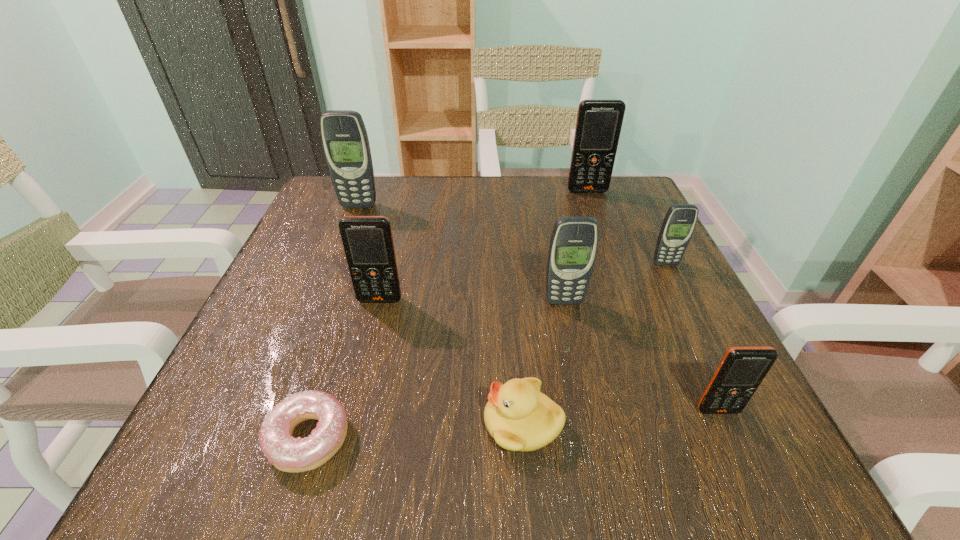
You are a GUI agent. You are given a task and a screenshot of the screen. Output one action in this format:
    pyautogui.click(x=<x>, y=<y>)
    Task: Click on the object that stands as the fourth closest to the second biggest orange cellular telephone
    
    Given the screenshot: What is the action you would take?
    pyautogui.click(x=344, y=137)

Image resolution: width=960 pixels, height=540 pixels. What are the coordinates of `cellular telephone that can be found as the closest to the farthest gray cellular telephone` in the screenshot? It's located at (368, 243).

Select which cellular telephone appears as the second closest to the farthest object. Please provide its 2D coordinates. Your answer should be formatted as a tuple, i.e. [(x, y)], where the tuple contains the x and y coordinates of a point satisfying the conditions above.

[(573, 246)]

Locate which orange cellular telephone is the closest to the nearest orange cellular telephone. Please provide its 2D coordinates. Your answer should be formatted as a tuple, i.e. [(x, y)], where the tuple contains the x and y coordinates of a point satisfying the conditions above.

[(368, 243)]

Select which orange cellular telephone is the second closest to the leftmost gray cellular telephone. Please provide its 2D coordinates. Your answer should be formatted as a tuple, i.e. [(x, y)], where the tuple contains the x and y coordinates of a point satisfying the conditions above.

[(599, 122)]

Identify which gray cellular telephone is the second nearest to the nearest gray cellular telephone. Please provide its 2D coordinates. Your answer should be formatted as a tuple, i.e. [(x, y)], where the tuple contains the x and y coordinates of a point satisfying the conditions above.

[(344, 137)]

Where is `gray cellular telephone that stands as the second closest to the leftmost gray cellular telephone`? This screenshot has width=960, height=540. gray cellular telephone that stands as the second closest to the leftmost gray cellular telephone is located at coordinates (677, 228).

Identify the location of free space that satisfies the following two spatial constraints: 1. on the screen of the nearest gray cellular telephone; 2. at the face of the duckling. (588, 423).

The width and height of the screenshot is (960, 540). What are the coordinates of `free region that satisfies the following two spatial constraints: 1. on the screen of the smallest gray cellular telephone; 2. at the face of the seventh tallest object` in the screenshot? It's located at [745, 423].